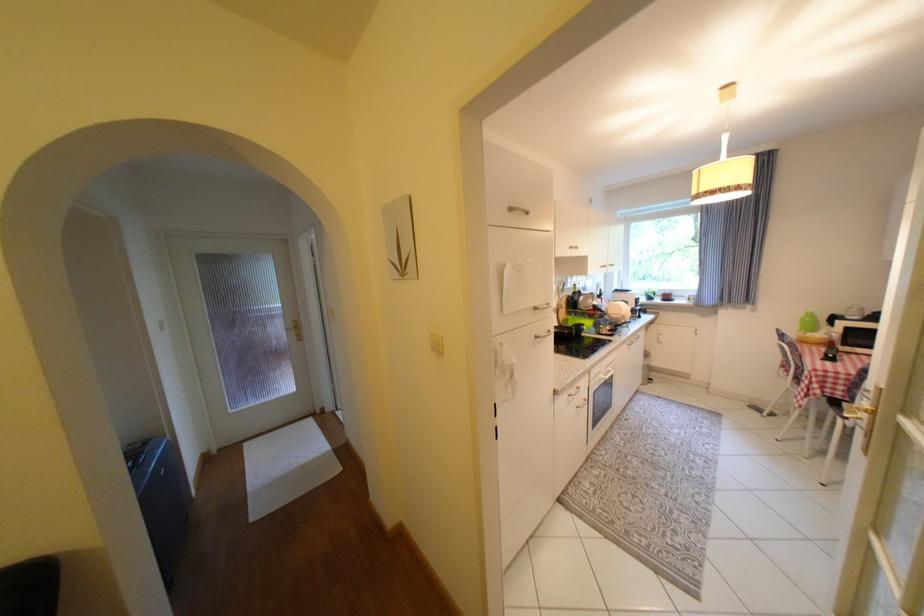
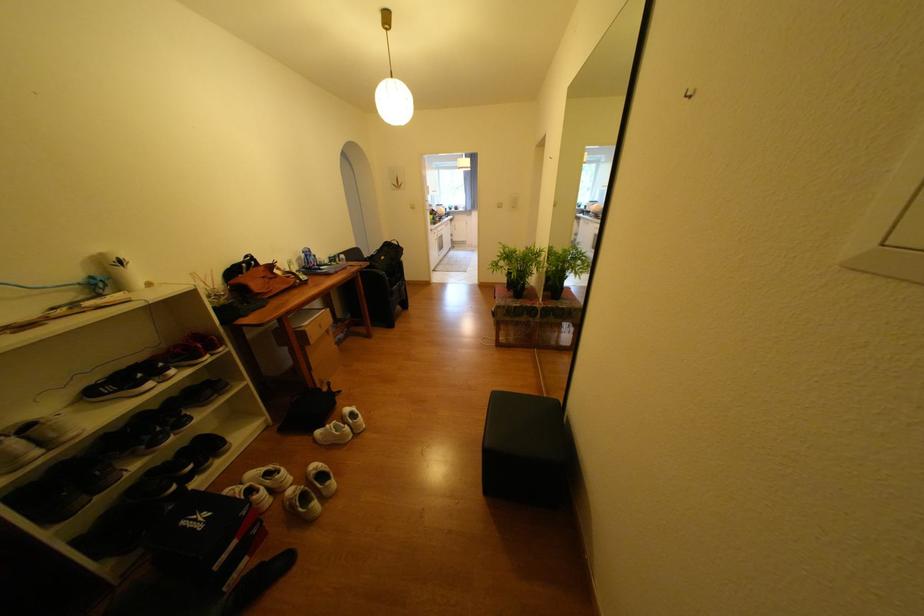
In the second image, find the point that corresponds to (720,300) in the first image.

(479, 208)